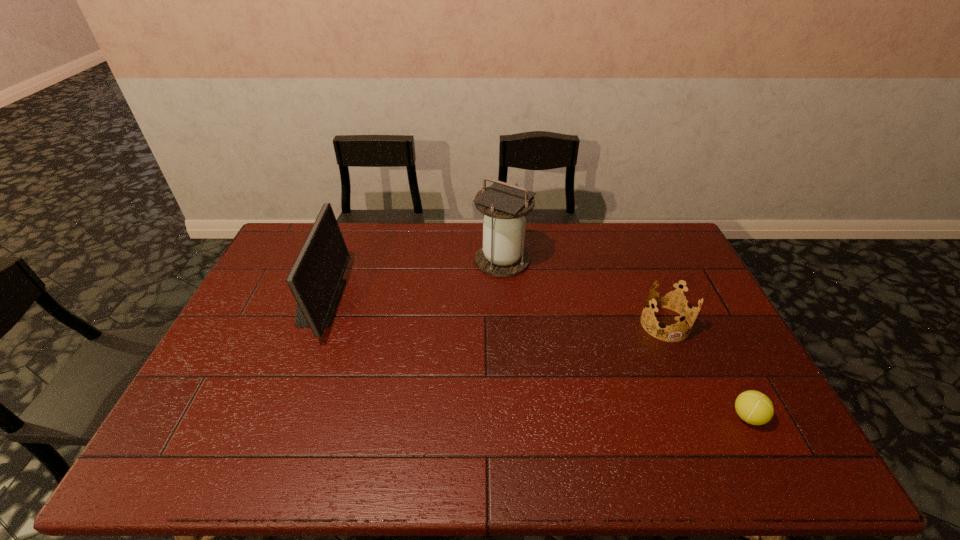
Find the location of a particular element. Image resolution: width=960 pixels, height=540 pixels. the second object from left to right is located at coordinates (503, 205).

Identify the location of the tallest object. (503, 205).

Locate an element on the screen. the leftmost object is located at coordinates coord(315,279).

Where is `the third shortest object`? The height and width of the screenshot is (540, 960). the third shortest object is located at coordinates (315, 279).

Locate an element on the screen. crown is located at coordinates (672, 305).

Identify the location of the shortest object. This screenshot has width=960, height=540. (753, 407).

Where is `tennis ball`? The image size is (960, 540). tennis ball is located at coordinates (753, 407).

Image resolution: width=960 pixels, height=540 pixels. I want to click on free space located on the back of the third object from right to left, so click(x=500, y=226).

What are the coordinates of `free space located 0.120m on the screen side of the computer monitor` in the screenshot? It's located at (378, 302).

This screenshot has height=540, width=960. Identify the location of vacant space located 0.260m on the left of the second shortest object. (555, 324).